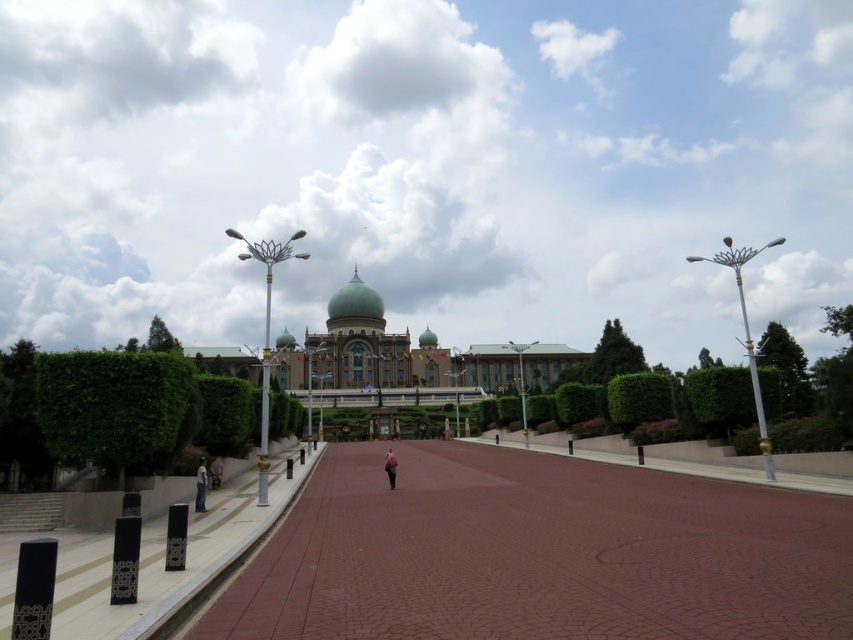
Question: Can you confirm if green glossy palace at center is wider than light brown leather jacket at center?

Choices:
 (A) no
 (B) yes

Answer: (B)

Question: Does green leafy hedge at left appear on the right side of light blue jeans at lower left?

Choices:
 (A) no
 (B) yes

Answer: (A)

Question: Which object is the farthest from the green glossy palace at center?

Choices:
 (A) brick paved walkway at center
 (B) light brown leather jacket at center
 (C) white concrete path at lower left
 (D) light blue jeans at lower left

Answer: (D)

Question: Which point is closer to the camera taking this photo?

Choices:
 (A) (517, 628)
 (B) (219, 458)
 (C) (619, 376)

Answer: (A)

Question: Is green leafy hedge at center wider than light blue jeans at lower left?

Choices:
 (A) no
 (B) yes

Answer: (B)

Question: Which object is positioned closest to the dark brown leather jacket at center?

Choices:
 (A) light brown leather jacket at center
 (B) brick paved walkway at center
 (C) green leafy hedge at left
 (D) white concrete path at lower left

Answer: (A)